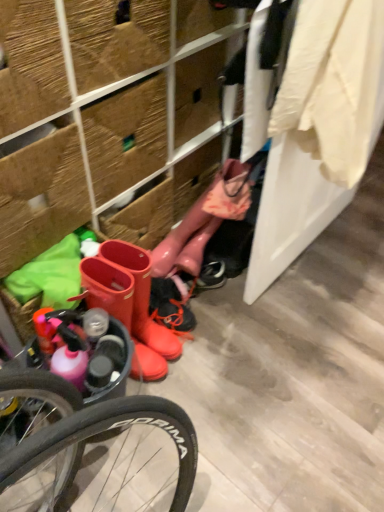
Question: From a real-world perspective, is rubber boots at center positioned above or below rubber boots at lower left?

Choices:
 (A) below
 (B) above

Answer: (A)

Question: In the image, is rubber boots at center on the left side or the right side of rubber boots at lower left?

Choices:
 (A) left
 (B) right

Answer: (B)

Question: Based on their relative distances, which object is farther from the white cotton shirt at upper right?

Choices:
 (A) glossy rubber boot at center
 (B) rubber boots at lower left
 (C) rubber boots at center

Answer: (C)

Question: Estimate the real-world distances between objects in this image. Which object is closer to the rubber boots at center?

Choices:
 (A) rubber boots at lower left
 (B) glossy rubber boot at center
 (C) white cotton shirt at upper right

Answer: (B)